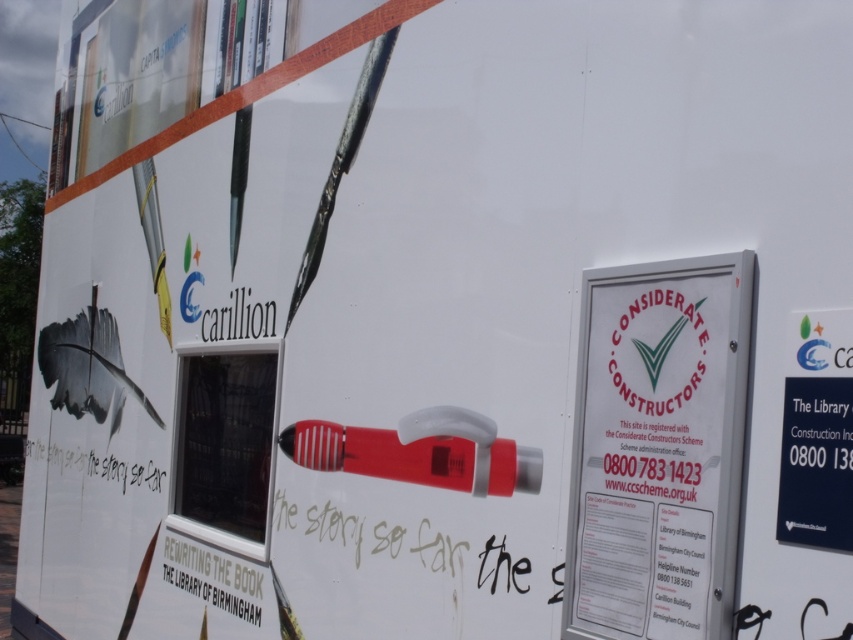
Question: Can you confirm if white plastic sign at center is bigger than red plastic pen at center?

Choices:
 (A) no
 (B) yes

Answer: (A)

Question: Among these objects, which one is nearest to the camera?

Choices:
 (A) red plastic pen at center
 (B) white plastic sign at center

Answer: (B)

Question: Can you confirm if white plastic sign at center is wider than red plastic pen at center?

Choices:
 (A) no
 (B) yes

Answer: (A)

Question: Which point is farther from the camera taking this photo?

Choices:
 (A) (721, 364)
 (B) (447, 483)

Answer: (B)

Question: Can you confirm if white plastic sign at center is bigger than red plastic pen at center?

Choices:
 (A) no
 (B) yes

Answer: (A)

Question: Which object is farther from the camera taking this photo?

Choices:
 (A) red plastic pen at center
 (B) white plastic sign at center

Answer: (A)